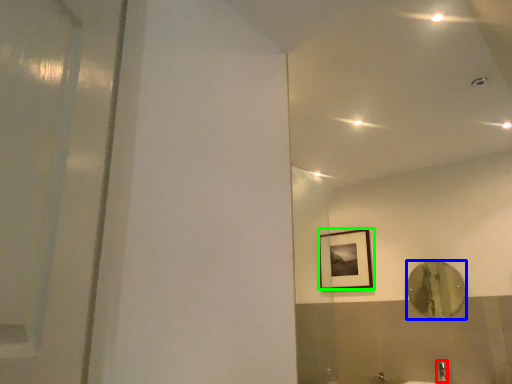
Question: Estimate the real-world distances between objects in this image. Which object is closer to faucet (highlighted by a red box), mirror (highlighted by a blue box) or picture frame (highlighted by a green box)?

Choices:
 (A) mirror
 (B) picture frame

Answer: (A)